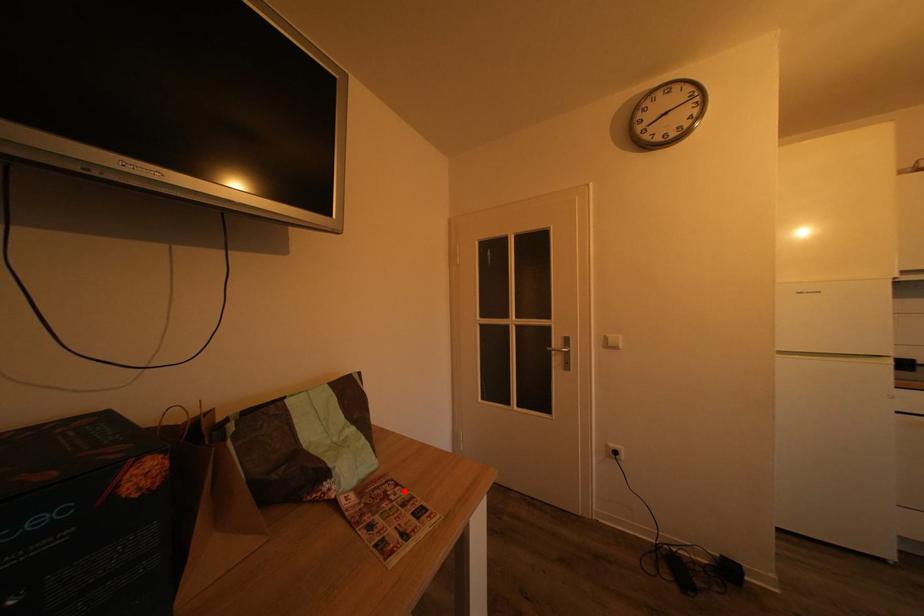
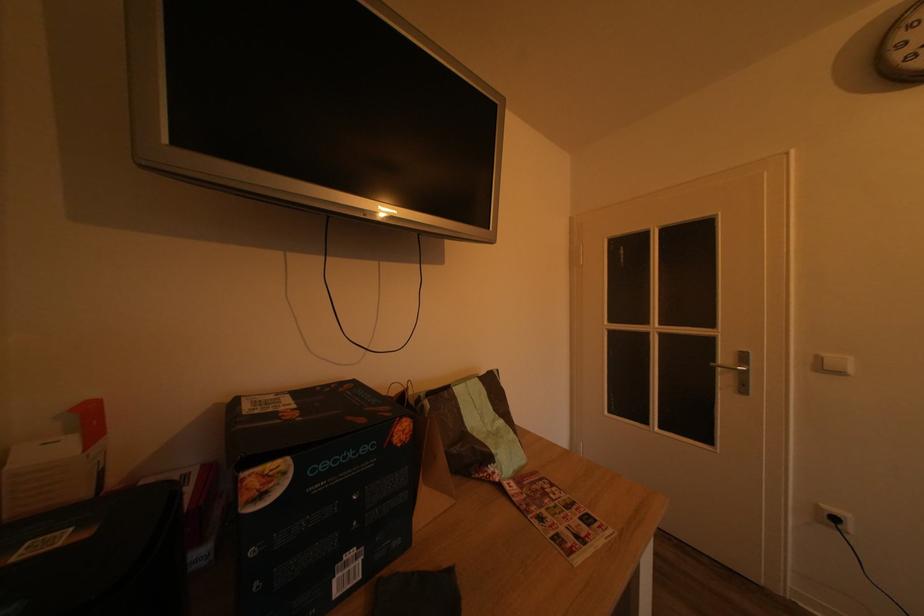
The point at the highlighted location is marked in the first image. Where is the corresponding point in the second image?

(560, 491)